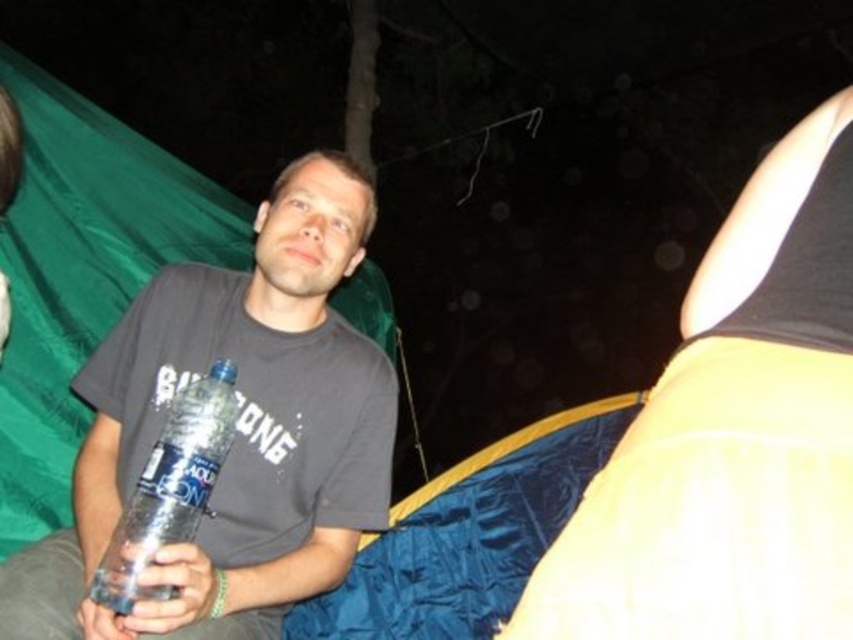
Question: Is matte yellow fabric at upper right to the left of matte plastic water bottle at center from the viewer's perspective?

Choices:
 (A) yes
 (B) no

Answer: (B)

Question: Can you confirm if matte yellow fabric at upper right is positioned above matte plastic water bottle at center?

Choices:
 (A) no
 (B) yes

Answer: (B)

Question: Which of the following is the closest to the observer?

Choices:
 (A) matte yellow fabric at upper right
 (B) clear plastic bottle at center
 (C) matte plastic water bottle at center

Answer: (A)

Question: Is matte yellow fabric at upper right positioned in front of matte plastic water bottle at center?

Choices:
 (A) yes
 (B) no

Answer: (A)

Question: Among these objects, which one is nearest to the camera?

Choices:
 (A) clear plastic bottle at center
 (B) matte yellow fabric at upper right
 (C) matte plastic water bottle at center

Answer: (B)

Question: Which is farther from the clear plastic bottle at center?

Choices:
 (A) matte plastic water bottle at center
 (B) matte yellow fabric at upper right

Answer: (B)